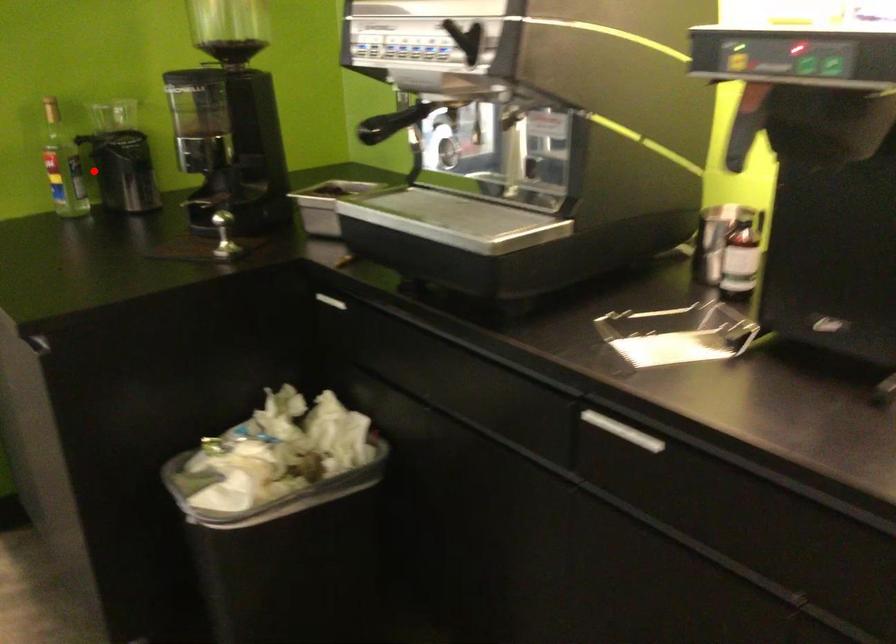
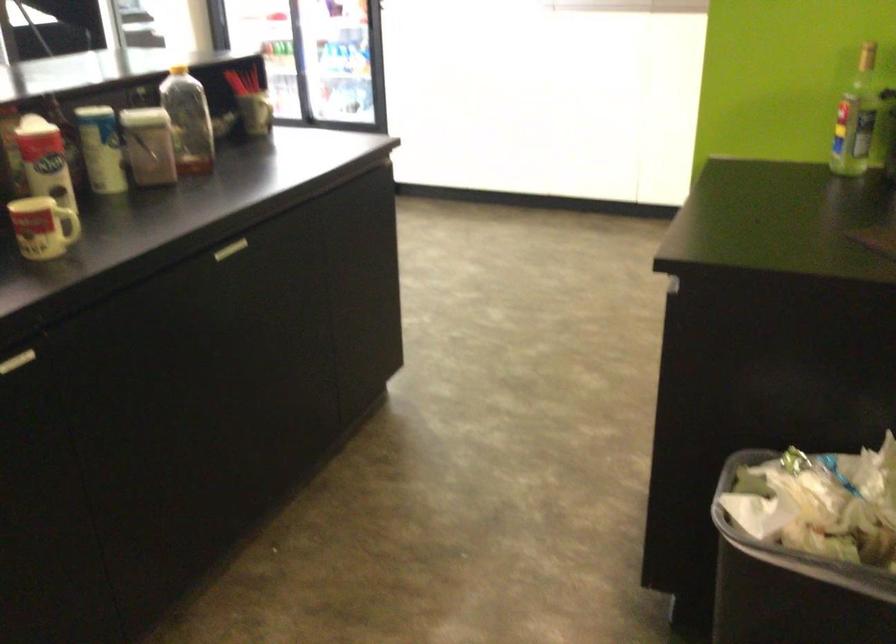
Question: I am providing you with two images of the same scene from different viewpoints. A red point is shown in image1. For the corresponding object point in image2, is it positioned nearer or farther from the camera?

Choices:
 (A) Nearer
 (B) Farther

Answer: (A)